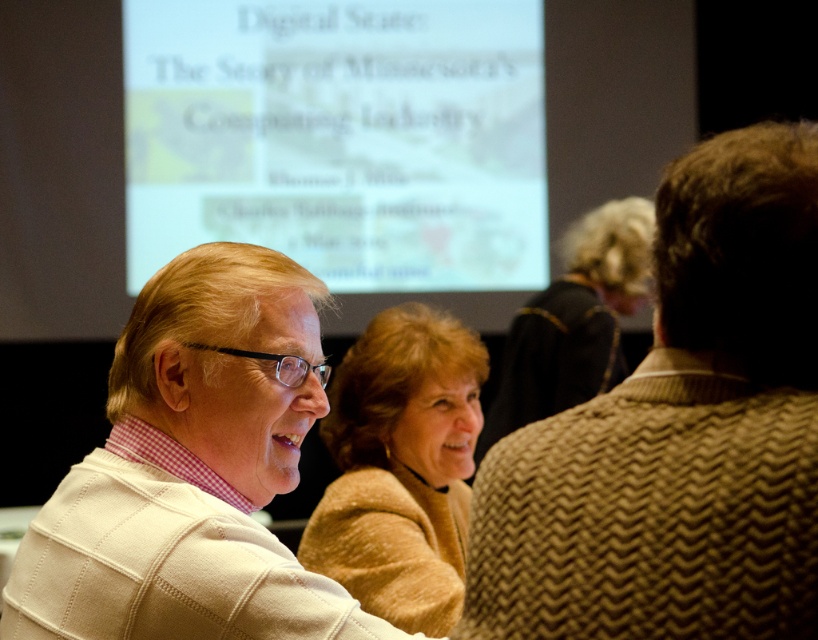
You are organizing a clothing donation drive and need to pack these two sweaters into a box. The white knitted sweater at center and the light brown sweater at center are both at the center. Which sweater takes up more space in the box?

The light brown sweater at center takes up more space in the box because it occupies more space than the white knitted sweater at center.

You are standing in the conference room and notice two points marked in the scene. The first point is at coordinates point (169, 276) and the second is at point (464, 387). Which point is nearer to you?

Point (169, 276) is closer to the viewer than point (464, 387).

You are an interior designer assessing the layout of this conference room. You notice two sweaters at the center of the image, the white knitted sweater at center and the light brown sweater at center. Which of these two sweaters is shorter in height?

The white knitted sweater at center is not as tall as the light brown sweater at center, so the white knitted sweater at center is shorter in height.